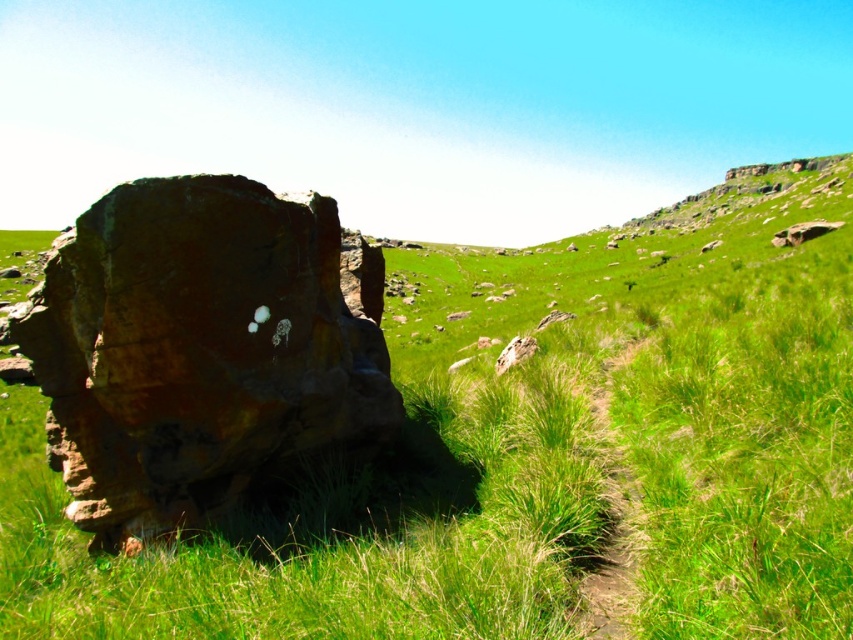
From the picture: Is the position of brown rough rock at left less distant than that of smooth brown rock at upper right?

Yes, brown rough rock at left is closer to the viewer.

Image resolution: width=853 pixels, height=640 pixels. Find the location of `brown rough rock at left`. brown rough rock at left is located at coordinates (199, 349).

From the picture: Who is more distant from viewer, (x=165, y=416) or (x=822, y=234)?

The point (x=822, y=234) is behind.

Where is `brown rough rock at left`? The image size is (853, 640). brown rough rock at left is located at coordinates (199, 349).

Does point (527, 262) lie in front of point (631, 605)?

That is False.

Who is positioned more to the left, green grassy at left or brown dirt path at center?

green grassy at left

Is point (18, 508) in front of point (598, 620)?

No, it is behind (598, 620).

Locate an element on the screen. green grassy at left is located at coordinates (521, 468).

Who is taller, brown rough rock at left or green grassy hillside at upper center?

green grassy hillside at upper center is taller.

Can you confirm if brown rough rock at left is shorter than green grassy hillside at upper center?

Yes.

Is point (386, 365) behind point (646, 230)?

No, it is not.

The width and height of the screenshot is (853, 640). I want to click on brown rough rock at left, so click(x=199, y=349).